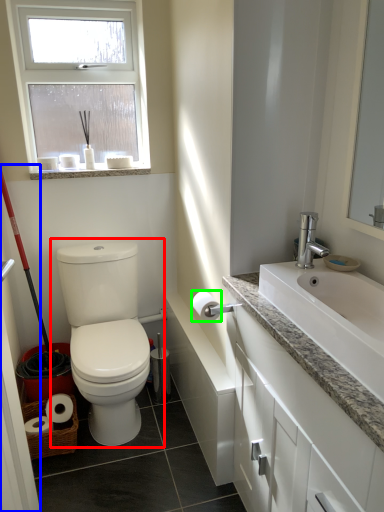
Question: Which is farther away from toilet (highlighted by a red box)? screen door (highlighted by a blue box) or toilet paper (highlighted by a green box)?

Choices:
 (A) screen door
 (B) toilet paper

Answer: (A)